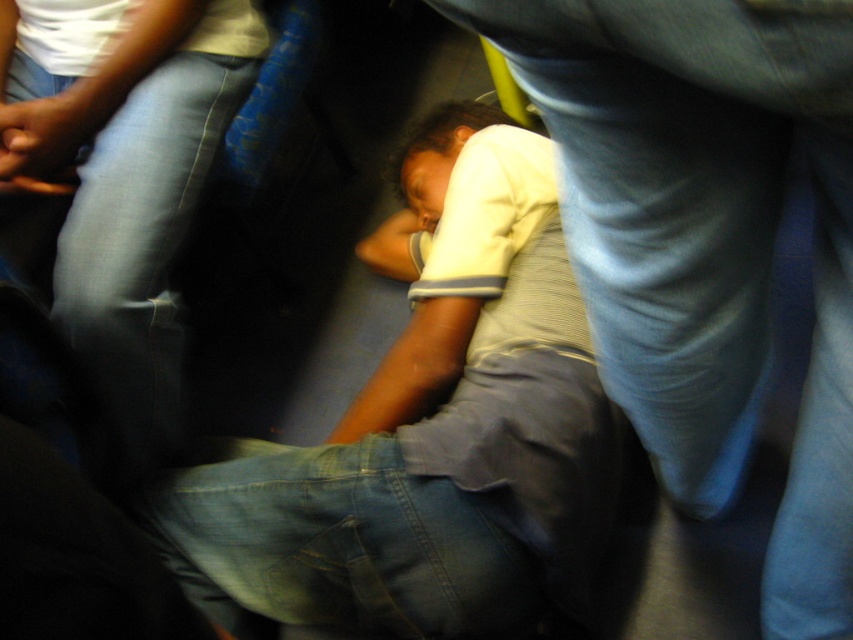
Which is below, white cotton shirt at center or gray striped shirt at center?

Positioned lower is gray striped shirt at center.

Can you confirm if white cotton shirt at center is positioned above gray striped shirt at center?

Yes.

Is point (437, 548) more distant than point (828, 148)?

Yes, it is behind point (828, 148).

Locate an element on the screen. white cotton shirt at center is located at coordinates (431, 432).